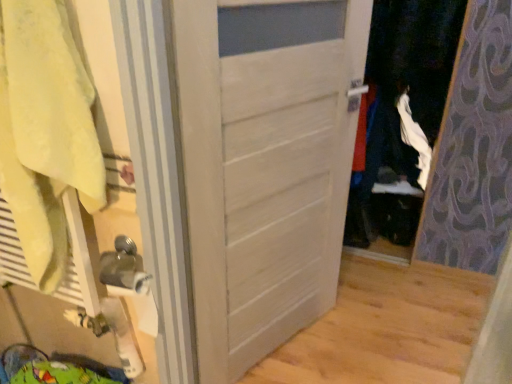
Question: Can you confirm if yellow cotton bath towel at left is thinner than white matte door at center?

Choices:
 (A) no
 (B) yes

Answer: (A)

Question: From the image's perspective, does yellow cotton bath towel at left appear higher than white matte door at center?

Choices:
 (A) no
 (B) yes

Answer: (B)

Question: Is yellow cotton bath towel at left not close to white matte door at center?

Choices:
 (A) yes
 (B) no

Answer: (B)

Question: Is yellow cotton bath towel at left at the right side of white matte door at center?

Choices:
 (A) no
 (B) yes

Answer: (A)

Question: Is yellow cotton bath towel at left with white matte door at center?

Choices:
 (A) yes
 (B) no

Answer: (B)

Question: Does yellow cotton bath towel at left have a smaller size compared to white matte door at center?

Choices:
 (A) no
 (B) yes

Answer: (B)

Question: Is white matte door at center facing towards yellow cotton bath towel at left?

Choices:
 (A) no
 (B) yes

Answer: (A)

Question: Does white matte door at center have a lesser width compared to yellow cotton bath towel at left?

Choices:
 (A) yes
 (B) no

Answer: (A)

Question: Is white matte door at center placed right next to yellow cotton bath towel at left?

Choices:
 (A) no
 (B) yes

Answer: (A)

Question: From a real-world perspective, is white matte door at center below yellow cotton bath towel at left?

Choices:
 (A) yes
 (B) no

Answer: (A)

Question: Can yellow cotton bath towel at left be found inside white matte door at center?

Choices:
 (A) no
 (B) yes

Answer: (A)

Question: Is white matte door at center outside of yellow cotton bath towel at left?

Choices:
 (A) yes
 (B) no

Answer: (A)

Question: From a real-world perspective, is yellow cotton bath towel at left physically located above or below white matte door at center?

Choices:
 (A) below
 (B) above

Answer: (B)